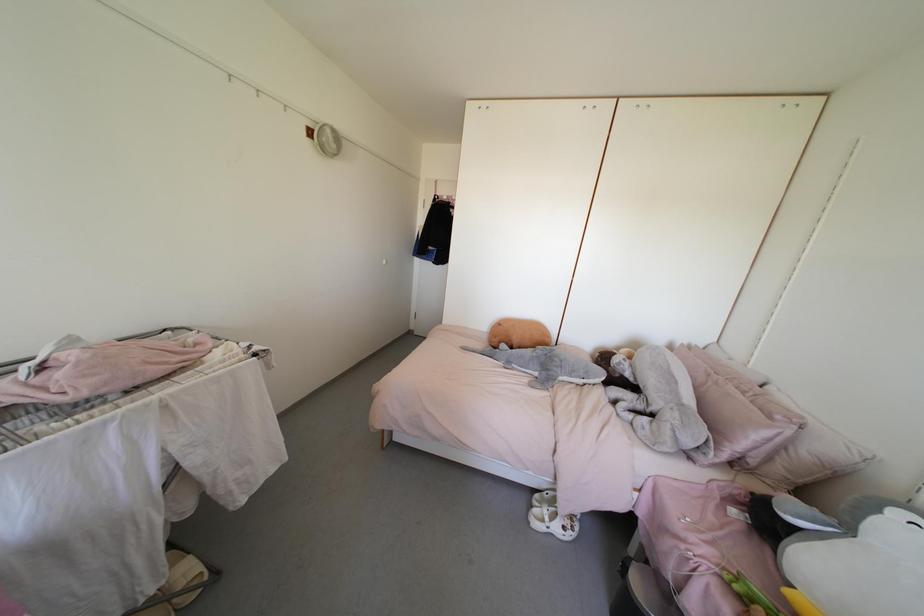
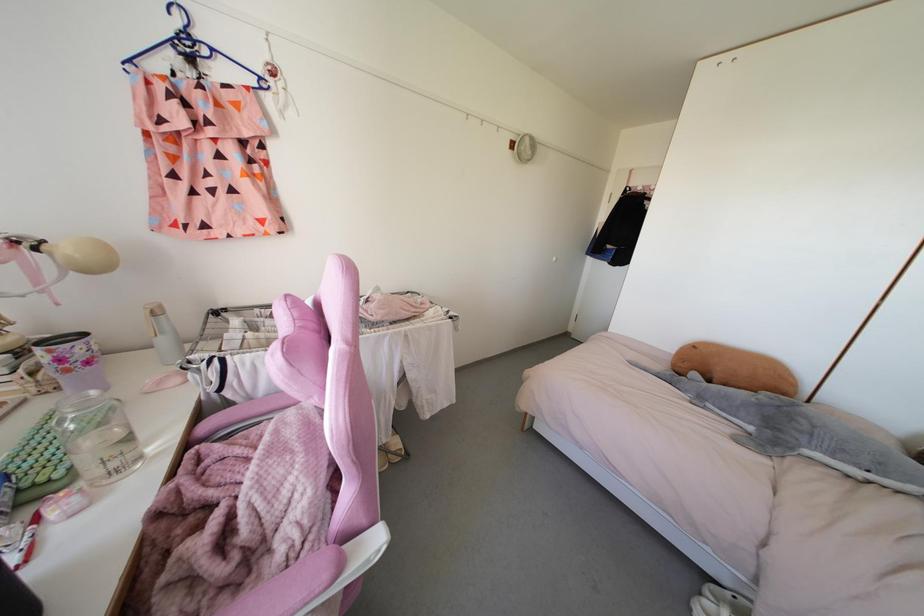
Find the pixel in the second image that matches the point at 573,371 in the first image.

(843, 450)